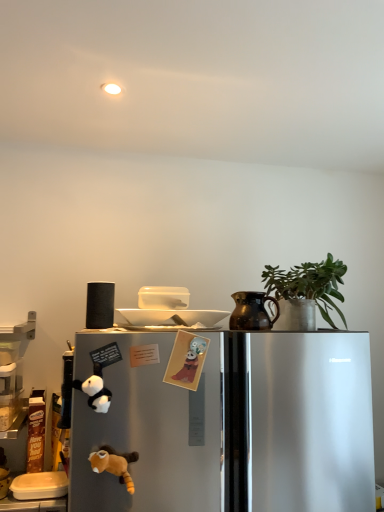
Describe the element at coordinates (252, 311) in the screenshot. I see `brown matte jug at upper right` at that location.

What do you see at coordinates (40, 485) in the screenshot? The height and width of the screenshot is (512, 384). I see `white plastic container at lower left` at bounding box center [40, 485].

Where is `satin silver refrigerator at center`? satin silver refrigerator at center is located at coordinates (229, 424).

From a real-world perspective, is satin silver refrigerator at center positioned above or below orange plush toy at lower left?

Clearly, from a real-world perspective, satin silver refrigerator at center is below orange plush toy at lower left.

Is orange plush toy at lower left at the back of satin silver refrigerator at center?

satin silver refrigerator at center does not have its back to orange plush toy at lower left.

Considering the relative positions of satin silver refrigerator at center and orange plush toy at lower left in the image provided, is satin silver refrigerator at center to the left or to the right of orange plush toy at lower left?

Based on their positions, satin silver refrigerator at center is located to the right of orange plush toy at lower left.

Does satin silver refrigerator at center have a larger size compared to green matte plant at upper right?

Yes, satin silver refrigerator at center is bigger than green matte plant at upper right.

How many degrees apart are the facing directions of satin silver refrigerator at center and green matte plant at upper right?

3.08 degrees separate the facing orientations of satin silver refrigerator at center and green matte plant at upper right.

Between satin silver refrigerator at center and green matte plant at upper right, which one has more height?

satin silver refrigerator at center.

Is satin silver refrigerator at center positioned in front of green matte plant at upper right?

Yes, the depth of satin silver refrigerator at center is less than that of green matte plant at upper right.

Considering the positions of objects green matte plant at upper right and satin silver refrigerator at center in the image provided, who is more to the right, green matte plant at upper right or satin silver refrigerator at center?

Positioned to the right is green matte plant at upper right.

Which is in front, point (292, 278) or point (209, 490)?

The point (209, 490) is more forward.

Which of these two, green matte plant at upper right or satin silver refrigerator at center, is thinner?

With smaller width is green matte plant at upper right.

Which object is closer to the camera, green matte plant at upper right or satin silver refrigerator at center?

satin silver refrigerator at center is in front.

Considering the relative sizes of satin silver refrigerator at center and brown matte jug at upper right in the image provided, is satin silver refrigerator at center bigger than brown matte jug at upper right?

Yes.

Based on the photo, from the image's perspective, is satin silver refrigerator at center above or below brown matte jug at upper right?

Clearly, from the image's perspective, satin silver refrigerator at center is below brown matte jug at upper right.

From a real-world perspective, is satin silver refrigerator at center physically below brown matte jug at upper right?

Indeed, from a real-world perspective, satin silver refrigerator at center is positioned beneath brown matte jug at upper right.

Can you confirm if satin silver refrigerator at center is taller than brown matte jug at upper right?

Yes, satin silver refrigerator at center is taller than brown matte jug at upper right.

From the image's perspective, is green matte plant at upper right over orange plush toy at lower left?

Correct, green matte plant at upper right appears higher than orange plush toy at lower left in the image.

Considering the positions of points (317, 301) and (107, 462), is point (317, 301) closer to camera compared to point (107, 462)?

No.

How many degrees apart are the facing directions of green matte plant at upper right and orange plush toy at lower left?

green matte plant at upper right and orange plush toy at lower left are facing 7.52 degrees away from each other.

Would you say green matte plant at upper right is inside or outside orange plush toy at lower left?

green matte plant at upper right exists outside the volume of orange plush toy at lower left.

From a real-world perspective, who is located lower, white plastic container at lower left or brown matte jug at upper right?

From a 3D spatial view, white plastic container at lower left is below.

Is white plastic container at lower left looking in the opposite direction of brown matte jug at upper right?

No, white plastic container at lower left is not facing away from brown matte jug at upper right.

From the image's perspective, is white plastic container at lower left located above or below brown matte jug at upper right?

Based on their image positions, white plastic container at lower left is located beneath brown matte jug at upper right.

Looking at their sizes, would you say white plastic container at lower left is wider or thinner than brown matte jug at upper right?

In the image, white plastic container at lower left appears to be wider than brown matte jug at upper right.

Considering their positions, is orange plush toy at lower left located in front of or behind brown matte jug at upper right?

orange plush toy at lower left is in front of brown matte jug at upper right.

From the image's perspective, is orange plush toy at lower left located above brown matte jug at upper right?

No, from the image's perspective, orange plush toy at lower left is not on top of brown matte jug at upper right.

Can you confirm if orange plush toy at lower left is positioned to the left of brown matte jug at upper right?

Yes, orange plush toy at lower left is to the left of brown matte jug at upper right.

Based on the photo, does orange plush toy at lower left touch brown matte jug at upper right?

No, orange plush toy at lower left is not with brown matte jug at upper right.

The width and height of the screenshot is (384, 512). I want to click on toy on the left of satin silver refrigerator at center, so click(x=114, y=464).

The image size is (384, 512). I want to click on refrigerator below the green matte plant at upper right (from a real-world perspective), so click(x=229, y=424).

From the picture: Based on their spatial positions, is orange plush toy at lower left or brown matte jug at upper right further from satin silver refrigerator at center?

orange plush toy at lower left lies further to satin silver refrigerator at center than the other object.

When comparing their distances from white plastic container at lower left, does satin silver refrigerator at center or brown matte jug at upper right seem closer?

Among the two, satin silver refrigerator at center is located nearer to white plastic container at lower left.

Which object lies nearer to the anchor point green matte plant at upper right, satin silver refrigerator at center or brown matte jug at upper right?

brown matte jug at upper right lies closer to green matte plant at upper right than the other object.

Looking at this image, based on their spatial positions, is satin silver refrigerator at center or orange plush toy at lower left further from green matte plant at upper right?

Based on the image, orange plush toy at lower left appears to be further to green matte plant at upper right.

In the scene shown: Looking at the image, which one is located further to green matte plant at upper right, orange plush toy at lower left or satin silver refrigerator at center?

orange plush toy at lower left.

Estimate the real-world distances between objects in this image. Which object is further from brown matte jug at upper right, green matte plant at upper right or orange plush toy at lower left?

orange plush toy at lower left is positioned further to the anchor brown matte jug at upper right.

Which object lies further to the anchor point satin silver refrigerator at center, green matte plant at upper right or orange plush toy at lower left?

green matte plant at upper right.

Which object lies further to the anchor point brown matte jug at upper right, white plastic container at lower left or orange plush toy at lower left?

white plastic container at lower left is positioned further to the anchor brown matte jug at upper right.

Locate an element on the screen. refrigerator located between white plastic container at lower left and brown matte jug at upper right in the left-right direction is located at coordinates (229, 424).

The image size is (384, 512). Find the location of `refrigerator located between white plastic container at lower left and green matte plant at upper right in the left-right direction`. refrigerator located between white plastic container at lower left and green matte plant at upper right in the left-right direction is located at coordinates (229, 424).

You are a GUI agent. You are given a task and a screenshot of the screen. Output one action in this format:
    pyautogui.click(x=<x>, y=<y>)
    Task: Click on the jug between white plastic container at lower left and green matte plant at upper right
    
    Given the screenshot: What is the action you would take?
    pyautogui.click(x=252, y=311)

You are a GUI agent. You are given a task and a screenshot of the screen. Output one action in this format:
    pyautogui.click(x=<x>, y=<y>)
    Task: Click on the jug between orange plush toy at lower left and green matte plant at upper right
    This screenshot has height=512, width=384.
    Given the screenshot: What is the action you would take?
    pyautogui.click(x=252, y=311)